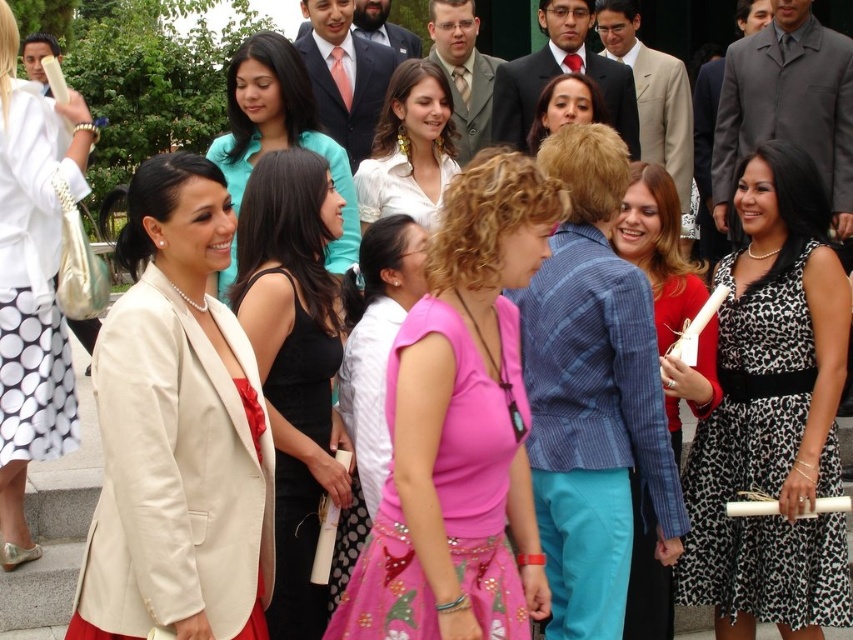
Question: Is matte cream blazer at center wider than black leopard print dress at right?

Choices:
 (A) no
 (B) yes

Answer: (A)

Question: Is matte blue blazer at center closer to camera compared to matte black suit at upper center?

Choices:
 (A) yes
 (B) no

Answer: (A)

Question: Which of the following is the closest to the observer?

Choices:
 (A) matte pink blouse at center
 (B) white glossy shirt at center

Answer: (B)

Question: Which point is farther from the camera taking this photo?

Choices:
 (A) (418, 102)
 (B) (550, 97)

Answer: (B)

Question: From the image, what is the correct spatial relationship of teal satin blouse at upper center in relation to white glossy shirt at center?

Choices:
 (A) below
 (B) above

Answer: (B)

Question: Which point is closer to the camera taking this photo?

Choices:
 (A) (674, 152)
 (B) (790, 26)
 (C) (410, 186)

Answer: (C)